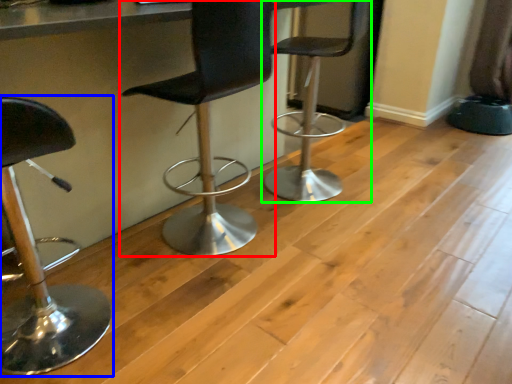
Question: Which object is the farthest from chair (highlighted by a red box)? Choose among these: chair (highlighted by a blue box) or chair (highlighted by a green box).

Choices:
 (A) chair
 (B) chair

Answer: (A)